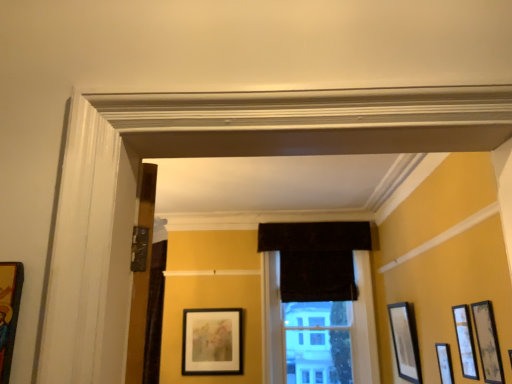
Question: Does velvet dark brown curtain at center have a smaller size compared to matte black picture frame at center, arranged as the first picture frame when viewed from the back?

Choices:
 (A) yes
 (B) no

Answer: (B)

Question: Is matte black picture frame at center, which ranks as the second picture frame in left-to-right order, a part of velvet dark brown curtain at center?

Choices:
 (A) no
 (B) yes

Answer: (A)

Question: Considering the relative positions of velvet dark brown curtain at center and matte black picture frame at center, the sixth picture frame viewed from the front, in the image provided, is velvet dark brown curtain at center to the right of matte black picture frame at center, the sixth picture frame viewed from the front, from the viewer's perspective?

Choices:
 (A) yes
 (B) no

Answer: (A)

Question: Does velvet dark brown curtain at center have a greater width compared to matte black picture frame at center, which is the fifth picture frame from right to left?

Choices:
 (A) yes
 (B) no

Answer: (A)

Question: Does velvet dark brown curtain at center have a greater height compared to matte black picture frame at center, arranged as the first picture frame when viewed from the back?

Choices:
 (A) yes
 (B) no

Answer: (A)

Question: Considering the positions of matte black picture frame at right, the 2th picture frame when ordered from right to left, and matte black picture frame at right, the 6th picture frame from the left, in the image, is matte black picture frame at right, the 2th picture frame when ordered from right to left, wider or thinner than matte black picture frame at right, the 6th picture frame from the left,?

Choices:
 (A) wide
 (B) thin

Answer: (B)

Question: From the image's perspective, is matte black picture frame at right, the 2th picture frame when ordered from right to left, above or below matte black picture frame at right, the 6th picture frame from the left?

Choices:
 (A) above
 (B) below

Answer: (A)

Question: From a real-world perspective, relative to matte black picture frame at right, the 1th picture frame in the right-to-left sequence, is matte black picture frame at right, the fourth picture frame viewed from the front, vertically above or below?

Choices:
 (A) below
 (B) above

Answer: (A)

Question: Is matte black picture frame at right, positioned as the fifth picture frame in left-to-right order, spatially inside matte black picture frame at right, the 1th picture frame in the right-to-left sequence, or outside of it?

Choices:
 (A) inside
 (B) outside

Answer: (B)

Question: Considering their positions, is wooden picture frame at left, placed as the 6th picture frame when sorted from back to front, located in front of or behind matte black picture frame at right, the fourth picture frame viewed from the front?

Choices:
 (A) behind
 (B) front

Answer: (B)

Question: Is point (0, 340) closer or farther from the camera than point (450, 357)?

Choices:
 (A) closer
 (B) farther

Answer: (A)

Question: Visually, is wooden picture frame at left, marked as the first picture frame in a left-to-right arrangement, positioned to the left or to the right of matte black picture frame at right, the fourth picture frame viewed from the front?

Choices:
 (A) left
 (B) right

Answer: (A)

Question: Considering the positions of wooden picture frame at left, the 6th picture frame viewed from the right, and matte black picture frame at right, positioned as the fifth picture frame in left-to-right order, in the image, is wooden picture frame at left, the 6th picture frame viewed from the right, wider or thinner than matte black picture frame at right, positioned as the fifth picture frame in left-to-right order,?

Choices:
 (A) wide
 (B) thin

Answer: (B)

Question: Would you say matte black picture frame at right, the 1th picture frame in the right-to-left sequence, is to the left or to the right of matte black picture frame at right, the fourth picture frame viewed from the front, in the picture?

Choices:
 (A) right
 (B) left

Answer: (A)

Question: Considering their positions, is matte black picture frame at right, acting as the 5th picture frame starting from the front, located in front of or behind matte black picture frame at right, the third picture frame from the back?

Choices:
 (A) front
 (B) behind

Answer: (B)